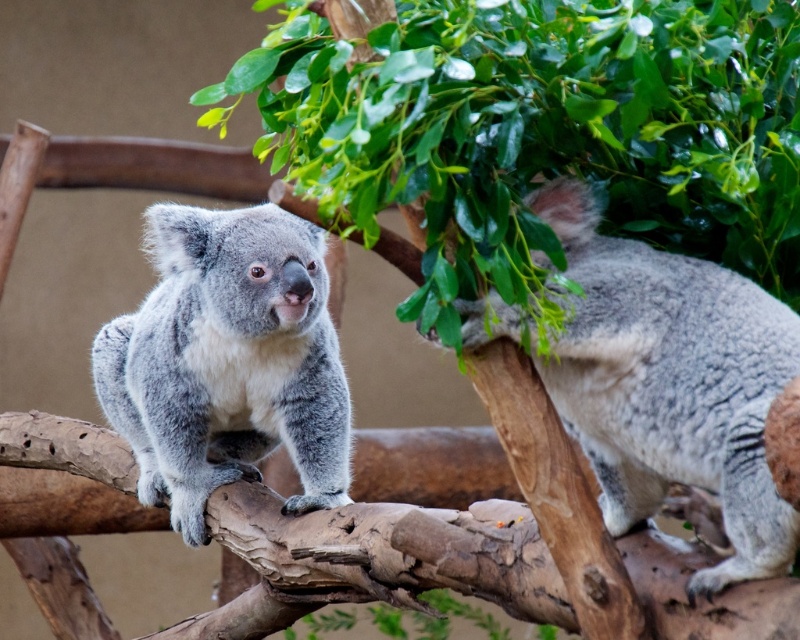
Question: Which object is farther from the camera taking this photo?

Choices:
 (A) gray fluffy koala at right
 (B) gray fluffy koala at center

Answer: (B)

Question: Among these objects, which one is nearest to the camera?

Choices:
 (A) gray fluffy koala at center
 (B) gray fluffy koala at right

Answer: (B)

Question: Can you confirm if gray fluffy koala at right is positioned to the left of gray fluffy koala at center?

Choices:
 (A) no
 (B) yes

Answer: (A)

Question: Is gray fluffy koala at right wider than gray fluffy koala at center?

Choices:
 (A) no
 (B) yes

Answer: (A)

Question: Does gray fluffy koala at right have a greater width compared to gray fluffy koala at center?

Choices:
 (A) no
 (B) yes

Answer: (A)